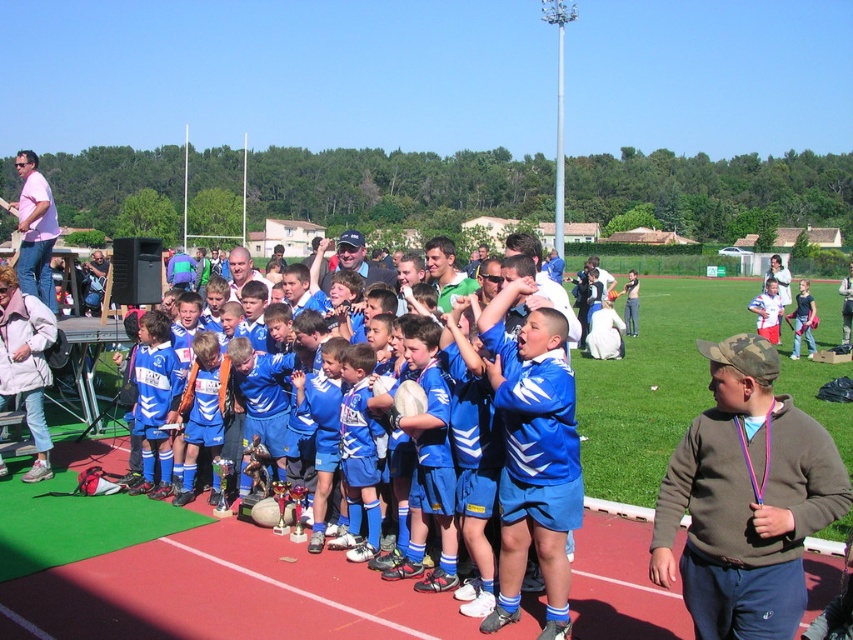
Is brown fleece sweatshirt at lower right above blue jersey at center?

No.

Which is above, brown fleece sweatshirt at lower right or blue jersey at center?

blue jersey at center

Identify the location of brown fleece sweatshirt at lower right. (746, 512).